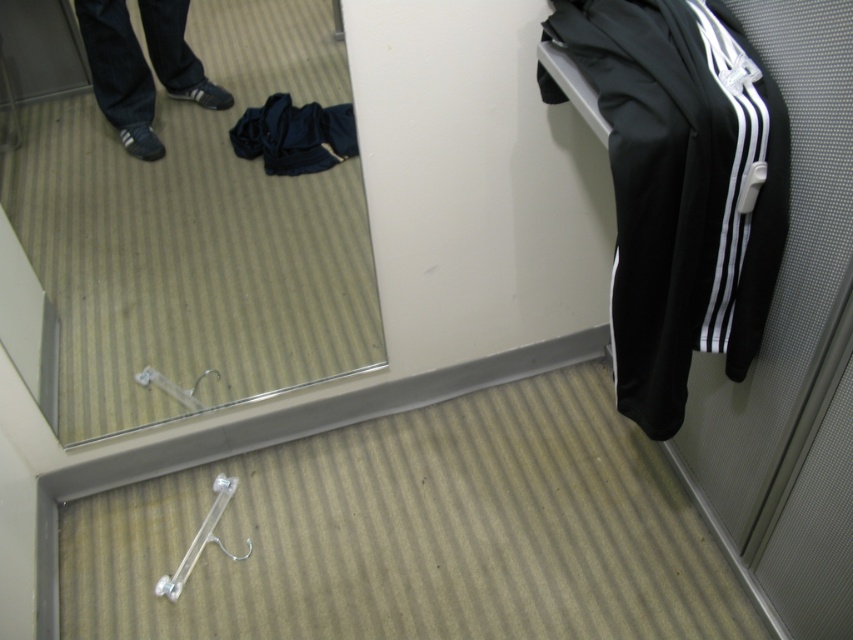
You are organizing clothes in a dressing room and need to place the black fabric tracksuit at right and the dark blue fabric at center. Which item should you place on a higher shelf if the shelf above can only hold items shorter than the other?

The dark blue fabric at center should be placed on the higher shelf because the black fabric tracksuit at right is taller than it, so the dark blue fabric at center is shorter and fits better on the higher shelf.

Imagine you are standing in the dressing room and looking at the two points marked in the image. Which point, point 1 at coordinates (125, 17) or point 2 at coordinates (341, 120), is closer to your current position?

Point 1 at coordinates (125, 17) is closer to the viewer than point 2 at coordinates (341, 120).